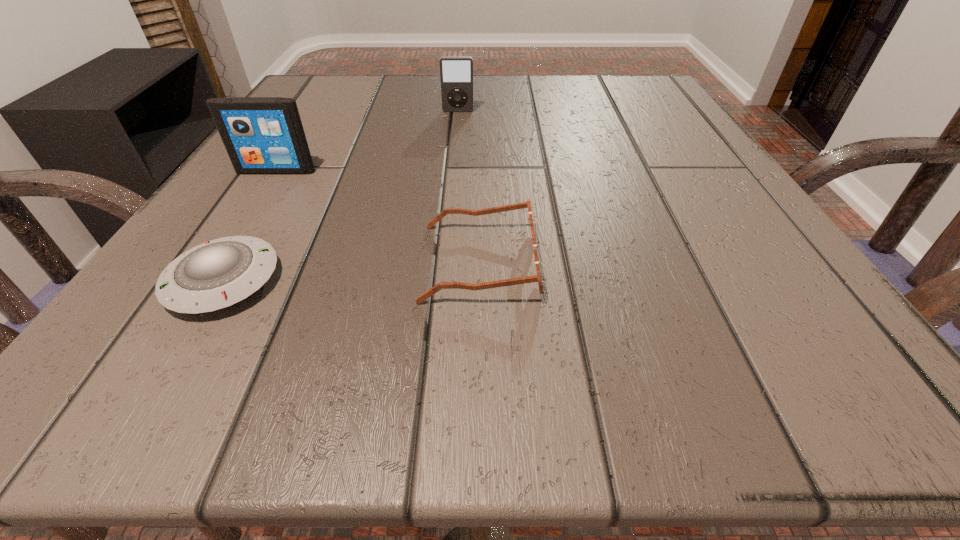
Find the location of a particular element. This screenshot has width=960, height=540. the nearer iPod is located at coordinates (262, 135).

Image resolution: width=960 pixels, height=540 pixels. I want to click on the left iPod, so click(262, 135).

Where is `the shorter iPod`? Image resolution: width=960 pixels, height=540 pixels. the shorter iPod is located at coordinates (456, 73).

Locate an element on the screen. The height and width of the screenshot is (540, 960). the farthest object is located at coordinates (456, 73).

This screenshot has height=540, width=960. Find the location of `the third tallest object`. the third tallest object is located at coordinates (535, 278).

Where is `the shortest object`? the shortest object is located at coordinates (217, 274).

Image resolution: width=960 pixels, height=540 pixels. Identify the location of free region located 0.220m on the front screen of the left iPod. (212, 271).

Image resolution: width=960 pixels, height=540 pixels. What are the coordinates of `free spot located on the front-facing side of the right iPod` in the screenshot? It's located at pos(451,193).

Locate an element on the screen. This screenshot has width=960, height=540. blank space located 0.100m on the front-facing side of the spectacles is located at coordinates (619, 262).

Find the location of `vacant space situated on the right of the saucer`. vacant space situated on the right of the saucer is located at coordinates (414, 281).